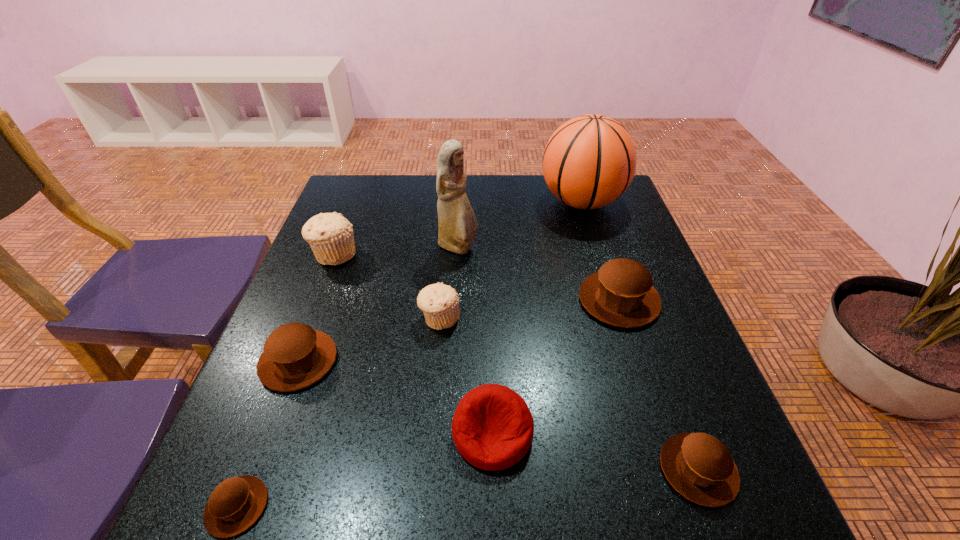
Find the location of a particular element. vacant area that satisfies the following two spatial constraints: 1. on the back side of the shortest object; 2. on the right side of the basketball is located at coordinates (355, 202).

The height and width of the screenshot is (540, 960). I want to click on vacant area that satisfies the following two spatial constraints: 1. on the front side of the third smallest brown muffin; 2. on the left side of the second smallest brown muffin, so click(258, 469).